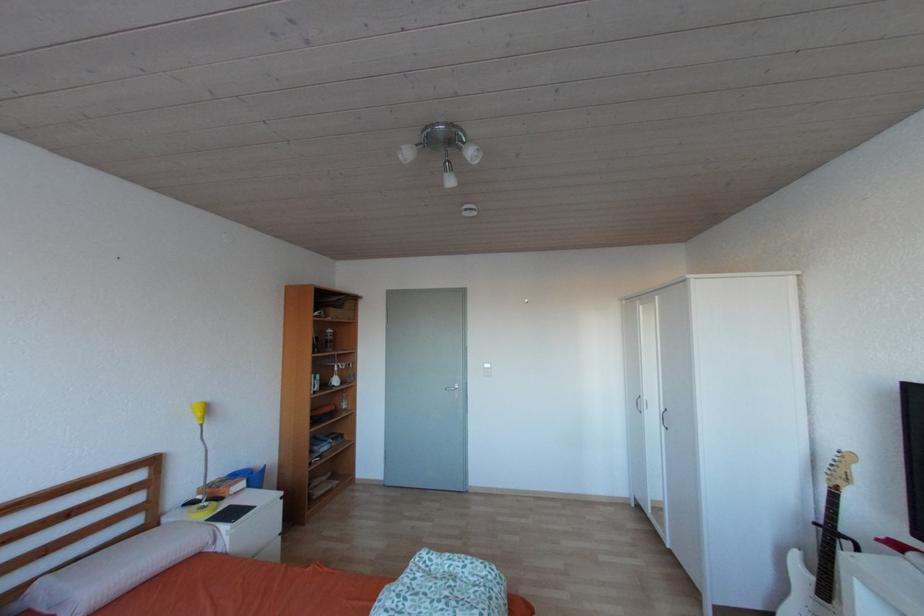
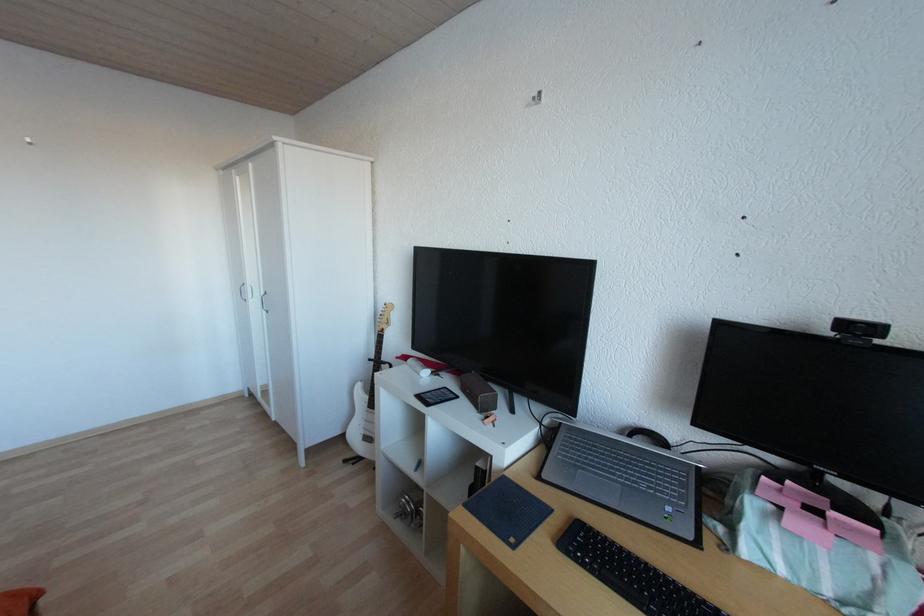
Question: The images are taken continuously from a first-person perspective. In which direction is your viewpoint rotating?

Choices:
 (A) Left
 (B) Right
 (C) Up
 (D) Down

Answer: (B)